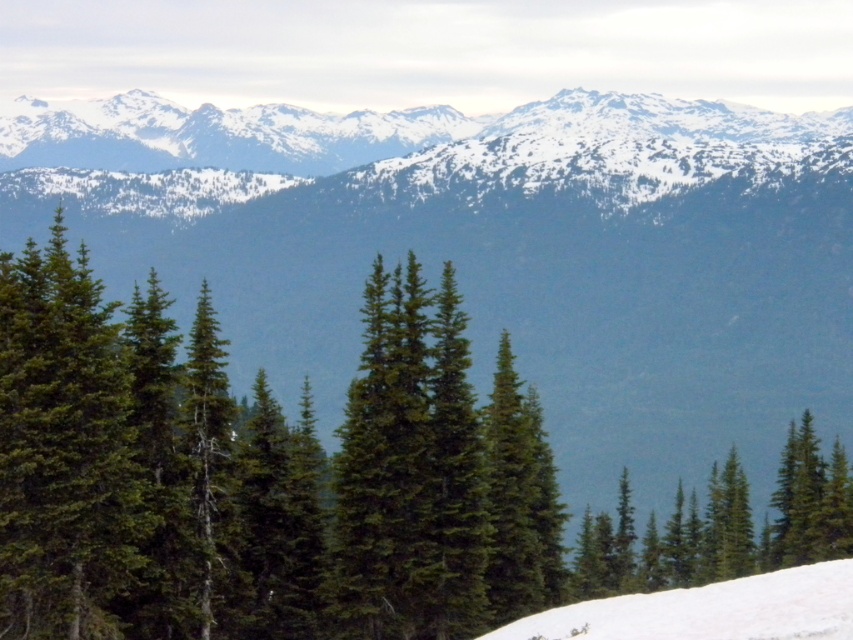
Does green matte tree at center appear under green matte tree at lower right?

Incorrect, green matte tree at center is not positioned below green matte tree at lower right.

From the picture: Is green matte tree at center in front of green matte tree at lower right?

Yes, green matte tree at center is in front of green matte tree at lower right.

Where is `green matte tree at center`? green matte tree at center is located at coordinates (318, 481).

Between green matte tree at lower right and white snow at lower right, which one has more height?

Standing taller between the two is green matte tree at lower right.

Who is positioned more to the left, green matte tree at lower right or white snow at lower right?

Positioned to the left is white snow at lower right.

Is point (737, 525) closer to camera compared to point (602, 600)?

No, (737, 525) is further to viewer.

The height and width of the screenshot is (640, 853). Identify the location of green matte tree at lower right. (723, 525).

Does green matte tree at center have a lesser width compared to white snow at lower right?

Incorrect, green matte tree at center's width is not less than white snow at lower right's.

Between point (776, 506) and point (740, 637), which one is positioned in front?

Point (740, 637) is more forward.

Measure the distance between point (363, 492) and camera.

Point (363, 492) and camera are 93.73 meters apart.

Identify the location of green matte tree at center. [318, 481].